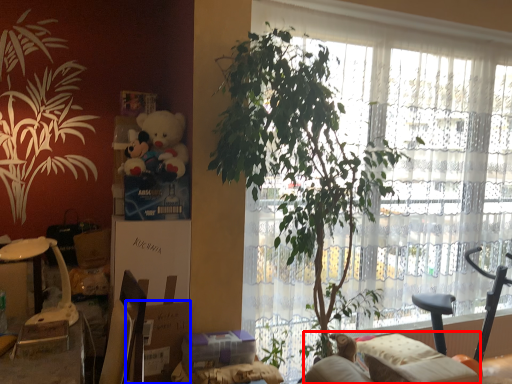
Question: Which point is further to the camera, couch (highlighted by a red box) or cardboard box (highlighted by a blue box)?

Choices:
 (A) couch
 (B) cardboard box

Answer: (A)